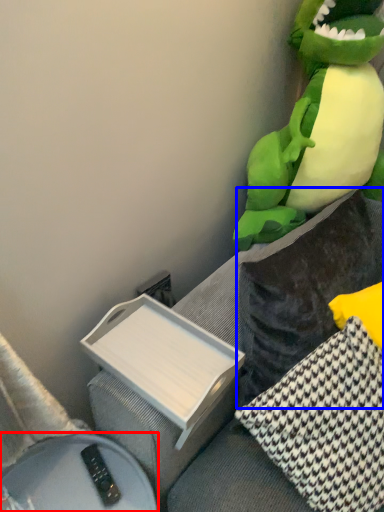
Question: Which of the following is the closest to the observer, furniture (highlighted by a red box) or pillow (highlighted by a blue box)?

Choices:
 (A) furniture
 (B) pillow

Answer: (B)